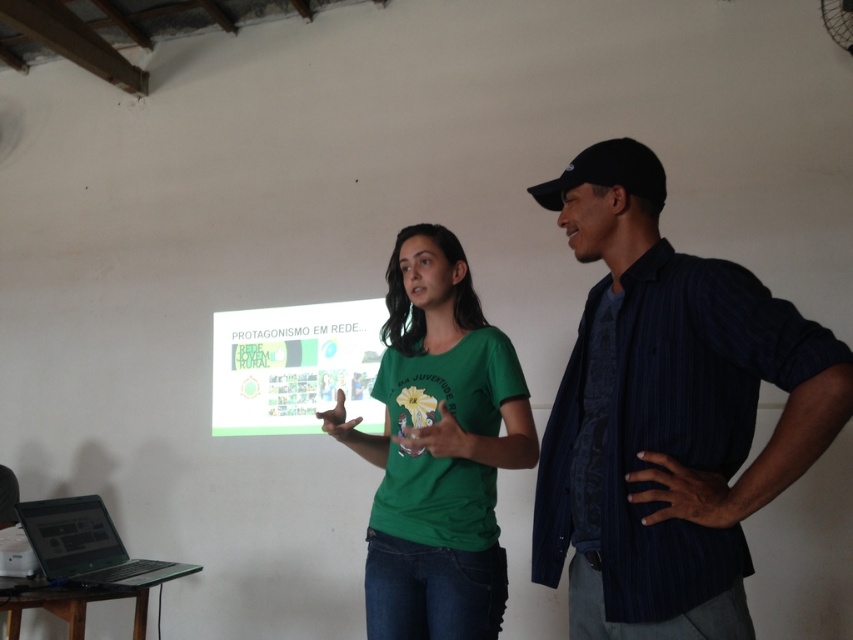
Is point (433, 620) closer to camera compared to point (3, 557)?

Yes, it is.

Between point (434, 406) and point (19, 525), which one is positioned in front?

Point (434, 406) is more forward.

Is point (463, 381) closer to camera compared to point (28, 561)?

Yes, point (463, 381) is closer to viewer.

This screenshot has height=640, width=853. I want to click on green matte t-shirt at center, so click(437, 449).

Does dark blue striped shirt at center have a smaller size compared to black plastic projector at lower left?

No.

Is point (712, 515) behind point (22, 570)?

No, (712, 515) is in front of (22, 570).

Where is `dark blue striped shirt at center`? The image size is (853, 640). dark blue striped shirt at center is located at coordinates (666, 413).

Who is taller, green matte t-shirt at center or black glossy laptop at lower left?

With more height is green matte t-shirt at center.

The image size is (853, 640). Identify the location of green matte t-shirt at center. pyautogui.click(x=437, y=449).